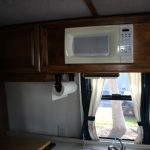
You are a GUI agent. You are given a task and a screenshot of the screen. Output one action in this format:
    pyautogui.click(x=<x>, y=<y>)
    Task: Click on the wooden cabinets
    The height and width of the screenshot is (150, 150).
    Given the screenshot: What is the action you would take?
    pyautogui.click(x=55, y=50), pyautogui.click(x=21, y=58)